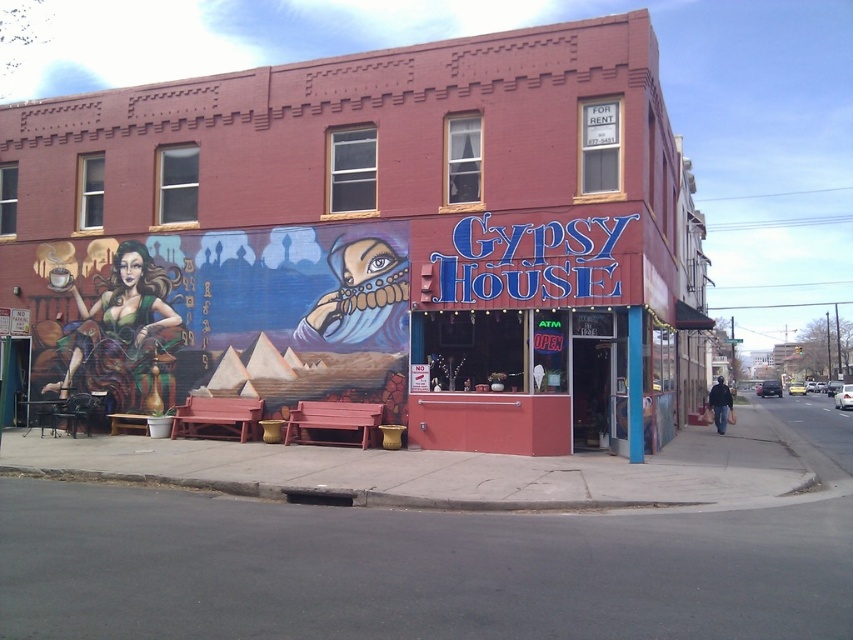
Question: Is matte black woman at left to the left of matte pink counter at center from the viewer's perspective?

Choices:
 (A) no
 (B) yes

Answer: (B)

Question: Is matte brick building at center thinner than matte black woman at left?

Choices:
 (A) yes
 (B) no

Answer: (B)

Question: Which is nearer to the matte pink counter at center?

Choices:
 (A) matte brick building at center
 (B) matte black woman at left

Answer: (B)

Question: Can you confirm if matte brick building at center is wider than matte black woman at left?

Choices:
 (A) yes
 (B) no

Answer: (A)

Question: Among these points, which one is farthest from the camera?

Choices:
 (A) (332, 244)
 (B) (421, 58)

Answer: (A)

Question: Which is farther from the matte pink counter at center?

Choices:
 (A) matte black woman at left
 (B) matte brick building at center

Answer: (B)